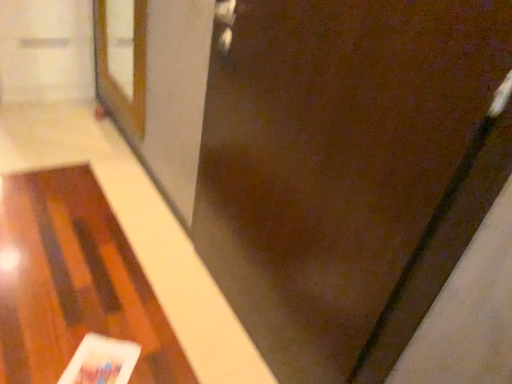
Find the location of `brown wooden screen door at upper left`. brown wooden screen door at upper left is located at coordinates (129, 65).

Image resolution: width=512 pixels, height=384 pixels. I want to click on brown matte door at center, so click(347, 169).

The image size is (512, 384). In order to click on wooden table at lower left in this screenshot , I will do `click(74, 282)`.

What are the coordinates of `table on the left of white glossy magazine at lower left` in the screenshot? It's located at (74, 282).

From the image's perspective, relative to wooden table at lower left, is white glossy magazine at lower left above or below?

white glossy magazine at lower left is below wooden table at lower left.

From the picture: Between white glossy magazine at lower left and wooden table at lower left, which one has smaller size?

Smaller between the two is white glossy magazine at lower left.

Is white glossy magazine at lower left oriented away from wooden table at lower left?

Yes, wooden table at lower left is at the back of white glossy magazine at lower left.

Does point (160, 334) lie behind point (146, 9)?

No.

Does wooden table at lower left turn towards brown wooden screen door at upper left?

No, wooden table at lower left does not turn towards brown wooden screen door at upper left.

Which object is positioned more to the right, wooden table at lower left or brown wooden screen door at upper left?

From the viewer's perspective, brown wooden screen door at upper left appears more on the right side.

Between wooden table at lower left and brown wooden screen door at upper left, which one has more height?

brown wooden screen door at upper left is taller.

Considering the positions of objects brown wooden screen door at upper left and white glossy magazine at lower left in the image provided, who is behind, brown wooden screen door at upper left or white glossy magazine at lower left?

Positioned behind is brown wooden screen door at upper left.

Is brown wooden screen door at upper left oriented towards white glossy magazine at lower left?

No, brown wooden screen door at upper left is not aimed at white glossy magazine at lower left.

From the picture: From the image's perspective, which is below, brown wooden screen door at upper left or white glossy magazine at lower left?

white glossy magazine at lower left is shown below in the image.

What's the angular difference between brown matte door at center and wooden table at lower left's facing directions?

0.791 degrees.

Between brown matte door at center and wooden table at lower left, which one appears on the left side from the viewer's perspective?

wooden table at lower left is more to the left.

Is brown matte door at center directly adjacent to wooden table at lower left?

brown matte door at center and wooden table at lower left are clearly separated.

Which point is more forward, (436,27) or (103,43)?

Positioned in front is point (436,27).

Looking at this image, is the depth of brown matte door at center greater than that of brown wooden screen door at upper left?

No.

Considering the sizes of objects brown matte door at center and brown wooden screen door at upper left in the image provided, who is taller, brown matte door at center or brown wooden screen door at upper left?

brown matte door at center.

From the image's perspective, who appears lower, brown matte door at center or brown wooden screen door at upper left?

brown matte door at center appears lower in the image.

From the image's perspective, between brown matte door at center and white glossy magazine at lower left, who is located below?

white glossy magazine at lower left appears lower in the image.

Is there a large distance between brown matte door at center and white glossy magazine at lower left?

They are positioned close to each other.

Can you confirm if brown matte door at center is taller than white glossy magazine at lower left?

Yes, brown matte door at center is taller than white glossy magazine at lower left.

From a real-world perspective, which is physically below, brown matte door at center or white glossy magazine at lower left?

white glossy magazine at lower left is physically lower.

How much distance is there between wooden table at lower left and brown matte door at center?

wooden table at lower left is 86.07 centimeters from brown matte door at center.

Could you tell me if wooden table at lower left is facing brown matte door at center?

No, wooden table at lower left is not aimed at brown matte door at center.

Based on the photo, is wooden table at lower left positioned beyond the bounds of brown matte door at center?

Absolutely, wooden table at lower left is external to brown matte door at center.

You are a GUI agent. You are given a task and a screenshot of the screen. Output one action in this format:
    pyautogui.click(x=<x>, y=<y>)
    Task: Click on the magazine behind the wooden table at lower left
    The width and height of the screenshot is (512, 384).
    Given the screenshot: What is the action you would take?
    pyautogui.click(x=101, y=361)

This screenshot has height=384, width=512. I want to click on table below the brown wooden screen door at upper left (from the image's perspective), so click(x=74, y=282).

When comparing their distances from brown wooden screen door at upper left, does wooden table at lower left or white glossy magazine at lower left seem closer?

wooden table at lower left is closer to brown wooden screen door at upper left.

When comparing their distances from brown matte door at center, does white glossy magazine at lower left or wooden table at lower left seem closer?

wooden table at lower left is positioned closer to the anchor brown matte door at center.

Considering their positions, is wooden table at lower left positioned further to brown wooden screen door at upper left than brown matte door at center?

Among the two, brown matte door at center is located further to brown wooden screen door at upper left.

Consider the image. Estimate the real-world distances between objects in this image. Which object is further from wooden table at lower left, brown matte door at center or white glossy magazine at lower left?

Among the two, brown matte door at center is located further to wooden table at lower left.

Based on their spatial positions, is brown wooden screen door at upper left or wooden table at lower left further from brown matte door at center?

brown wooden screen door at upper left.

Looking at the image, which one is located closer to wooden table at lower left, white glossy magazine at lower left or brown matte door at center?

Among the two, white glossy magazine at lower left is located nearer to wooden table at lower left.

Considering their positions, is brown matte door at center positioned closer to brown wooden screen door at upper left than wooden table at lower left?

Based on the image, wooden table at lower left appears to be nearer to brown wooden screen door at upper left.

When comparing their distances from wooden table at lower left, does white glossy magazine at lower left or brown wooden screen door at upper left seem further?

The object further to wooden table at lower left is brown wooden screen door at upper left.

At what (x,y) coordinates should I click in order to perform the action: click on table between brown wooden screen door at upper left and white glossy magazine at lower left in the vertical direction. Please return your answer as a coordinate pair (x, y). Looking at the image, I should click on (74, 282).

At what (x,y) coordinates should I click in order to perform the action: click on table located between brown matte door at center and brown wooden screen door at upper left in the depth direction. Please return your answer as a coordinate pair (x, y). This screenshot has height=384, width=512. Looking at the image, I should click on (74, 282).

Where is `door between brown wooden screen door at upper left and white glossy magazine at lower left in the up-down direction`? This screenshot has height=384, width=512. door between brown wooden screen door at upper left and white glossy magazine at lower left in the up-down direction is located at coordinates (347, 169).

Where is `magazine between wooden table at lower left and brown matte door at center from left to right`? Image resolution: width=512 pixels, height=384 pixels. magazine between wooden table at lower left and brown matte door at center from left to right is located at coordinates point(101,361).